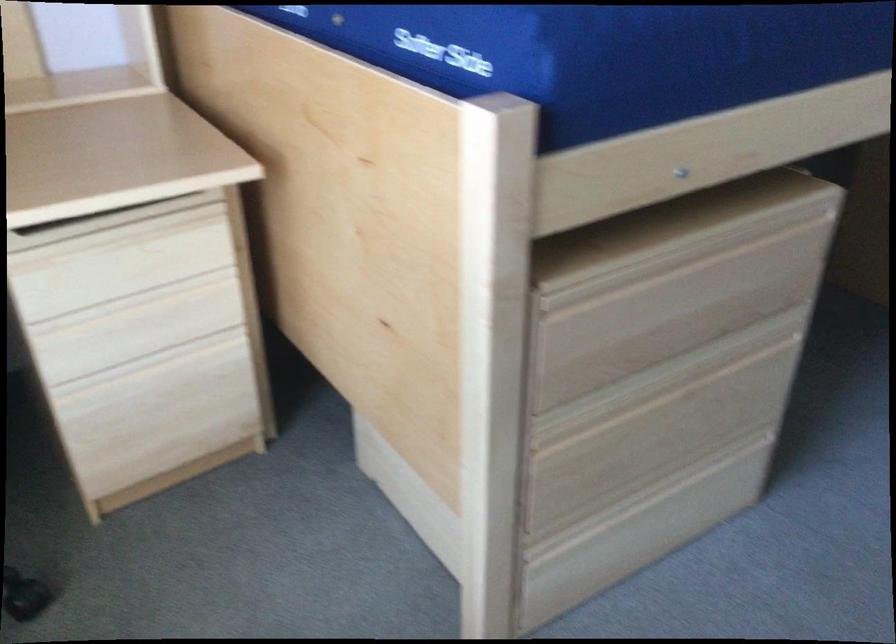
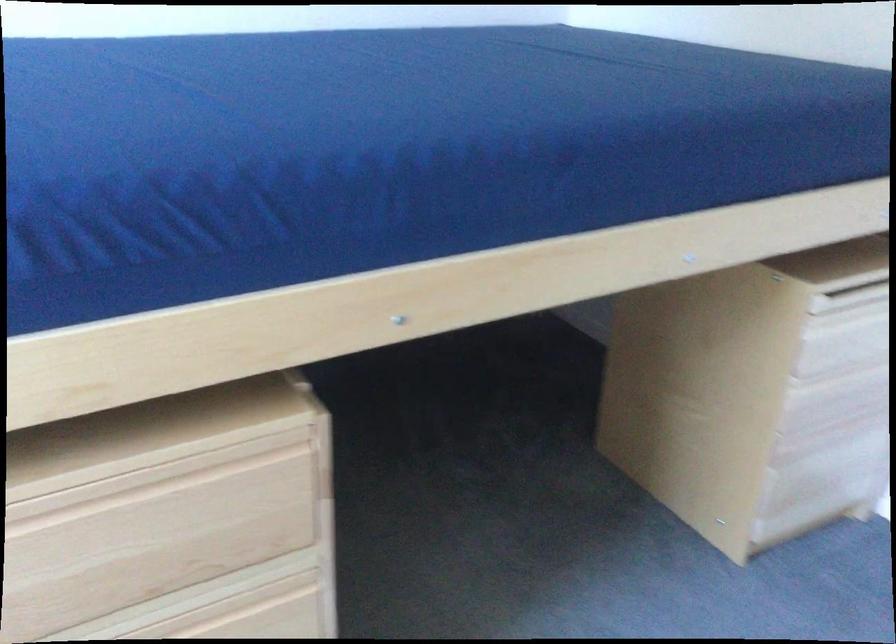
Find the pixel in the second image that matches pixel 738 254 in the first image.

(174, 494)